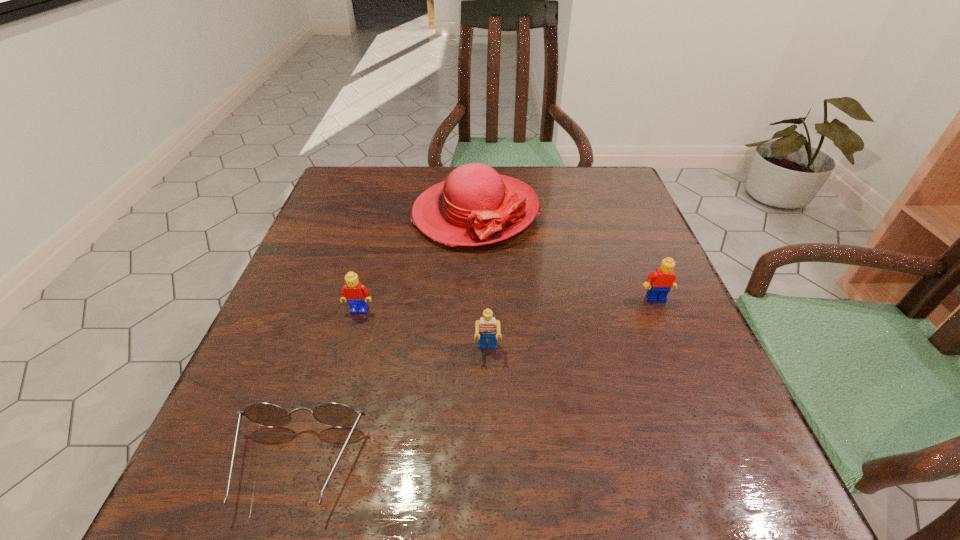
This screenshot has width=960, height=540. What are the coordinates of `vacant region at the far edge of the desktop` in the screenshot? It's located at (502, 171).

You are a GUI agent. You are given a task and a screenshot of the screen. Output one action in this format:
    pyautogui.click(x=<x>, y=<y>)
    Task: Click on the free location at the left edge of the desktop
    This screenshot has height=540, width=960.
    Given the screenshot: What is the action you would take?
    pyautogui.click(x=343, y=230)

At what (x,y) coordinates should I click in order to perform the action: click on free region at the right edge of the desktop. Please return your answer as a coordinate pair (x, y). Looking at the image, I should click on (713, 377).

Locate an element on the screen. The width and height of the screenshot is (960, 540). vacant space at the far left corner of the desktop is located at coordinates (343, 206).

Identify the location of free space at the far right corner of the desktop. Image resolution: width=960 pixels, height=540 pixels. (598, 188).

The height and width of the screenshot is (540, 960). In order to click on vacant space at the near right corner of the desktop in this screenshot , I will do `click(758, 495)`.

Locate an element on the screen. free space that is in between the second farthest Lego and the farthest Lego is located at coordinates [x=508, y=304].

This screenshot has height=540, width=960. I want to click on blank region between the hat and the shortest object, so click(x=386, y=339).

Image resolution: width=960 pixels, height=540 pixels. Find the location of `vacant area that lies between the tallest object and the nearest object`. vacant area that lies between the tallest object and the nearest object is located at coordinates (386, 339).

You are a GUI agent. You are given a task and a screenshot of the screen. Output one action in this format:
    pyautogui.click(x=<x>, y=<y>)
    Task: Click on the empty location between the spectacles and the nearest Lego
    The image size is (960, 540).
    Given the screenshot: What is the action you would take?
    (392, 408)